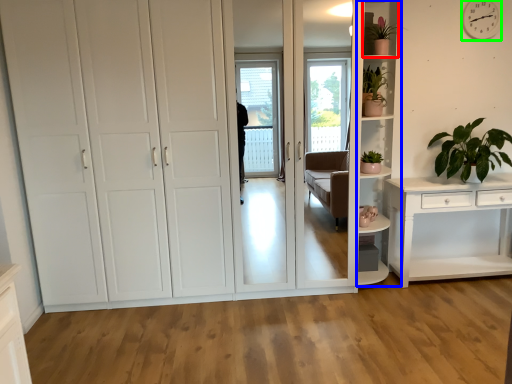
Question: Which is nearer to the shelf (highlighted by a red box)? shelf (highlighted by a blue box) or clock (highlighted by a green box).

Choices:
 (A) shelf
 (B) clock

Answer: (A)